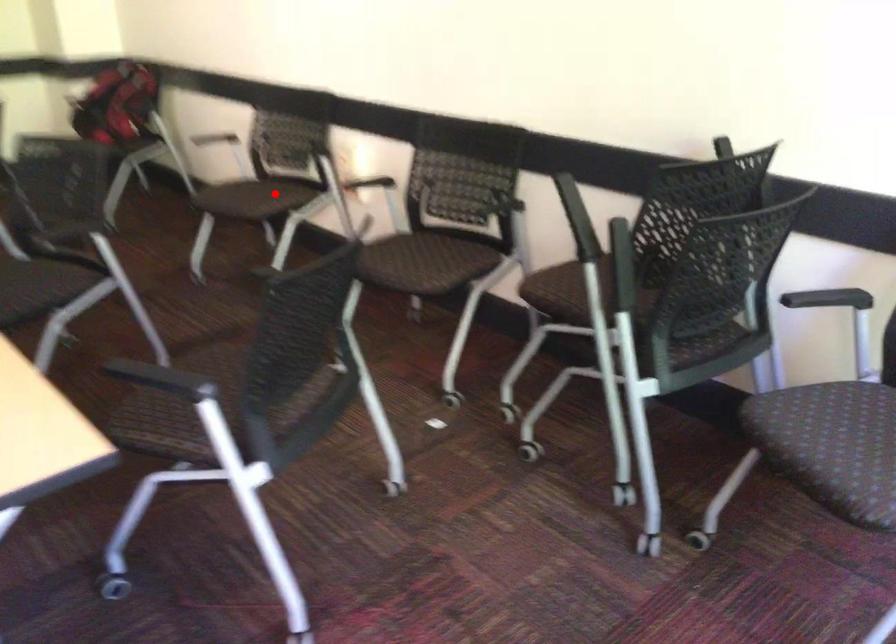
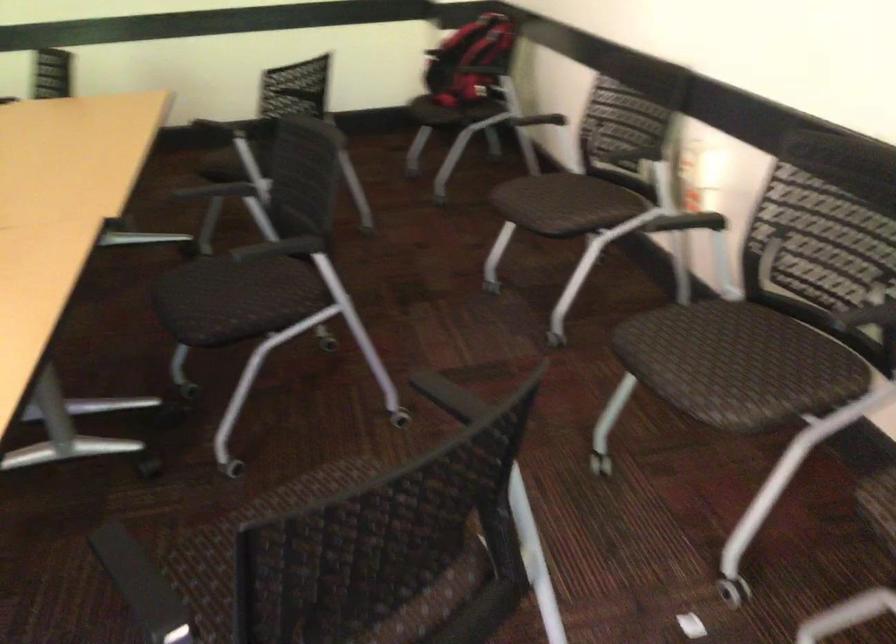
Where in the second image is the point corresponding to the highlighted location from the first image?

(581, 207)